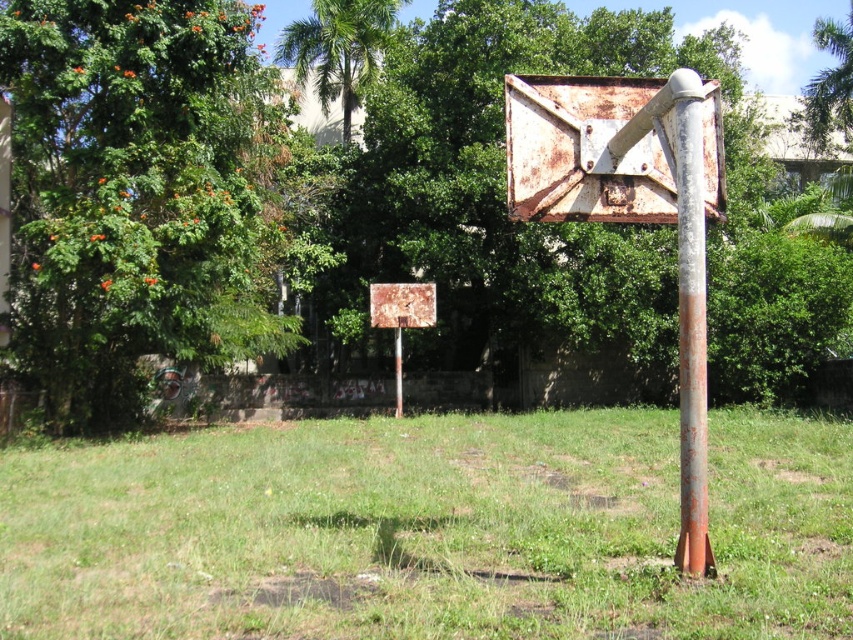
Does point (314, 44) come behind point (426, 316)?

Yes.

Is point (300, 83) closer to viewer compared to point (415, 314)?

That is False.

This screenshot has width=853, height=640. What do you see at coordinates (338, 51) in the screenshot? I see `green leafy tree at upper center` at bounding box center [338, 51].

The height and width of the screenshot is (640, 853). I want to click on green leafy tree at upper center, so click(x=338, y=51).

Is point (509, 83) positioned in front of point (366, 60)?

Yes, it is.

Is point (592, 92) farther from viewer compared to point (321, 32)?

That is False.

The image size is (853, 640). What are the coordinates of `rusty metal sign at upper right` in the screenshot? It's located at click(590, 148).

Between rusty metal pole at right and rusty metal pole at center, which one has less height?

Standing shorter between the two is rusty metal pole at center.

Is point (699, 129) positioned after point (393, 332)?

No, (699, 129) is in front of (393, 332).

This screenshot has height=640, width=853. I want to click on rusty metal pole at right, so click(691, 321).

This screenshot has width=853, height=640. What are the coordinates of `rusty metal pole at right` in the screenshot? It's located at (691, 321).